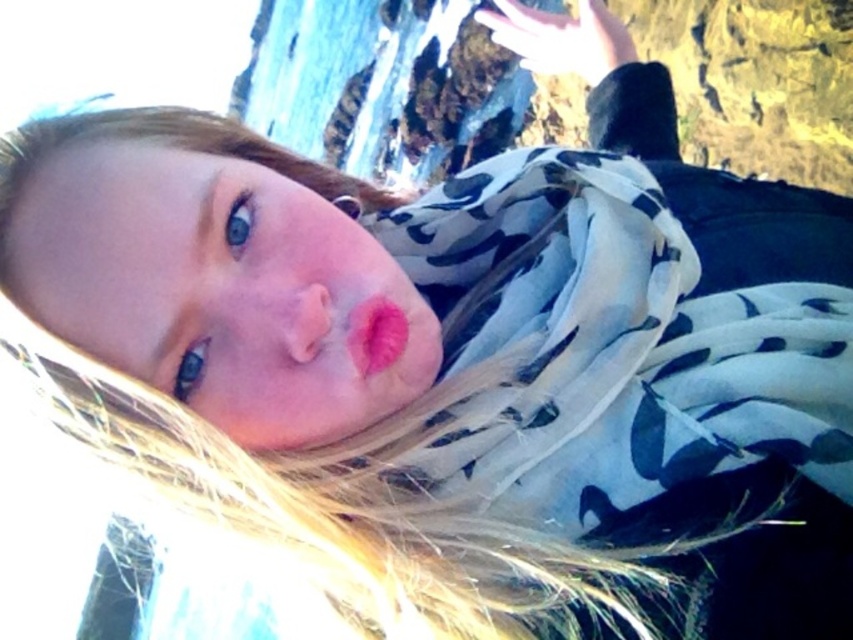
Which is behind, point (685, 515) or point (401, 333)?

Positioned behind is point (401, 333).

Is white floral scarf at center to the left of matte pink lipstick at center from the viewer's perspective?

In fact, white floral scarf at center is to the right of matte pink lipstick at center.

Describe the element at coordinates (622, 346) in the screenshot. This screenshot has width=853, height=640. I see `white floral scarf at center` at that location.

The width and height of the screenshot is (853, 640). I want to click on white floral scarf at center, so click(x=622, y=346).